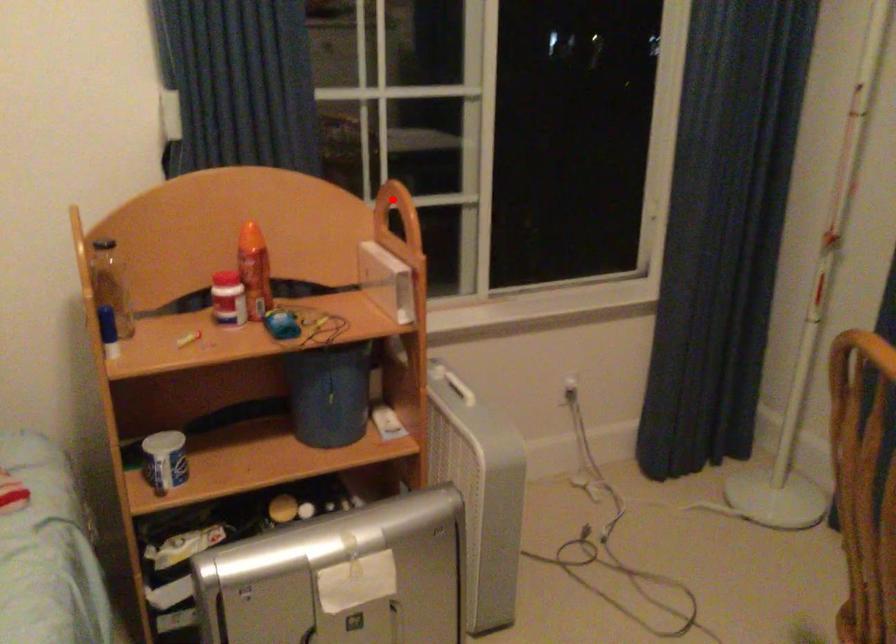
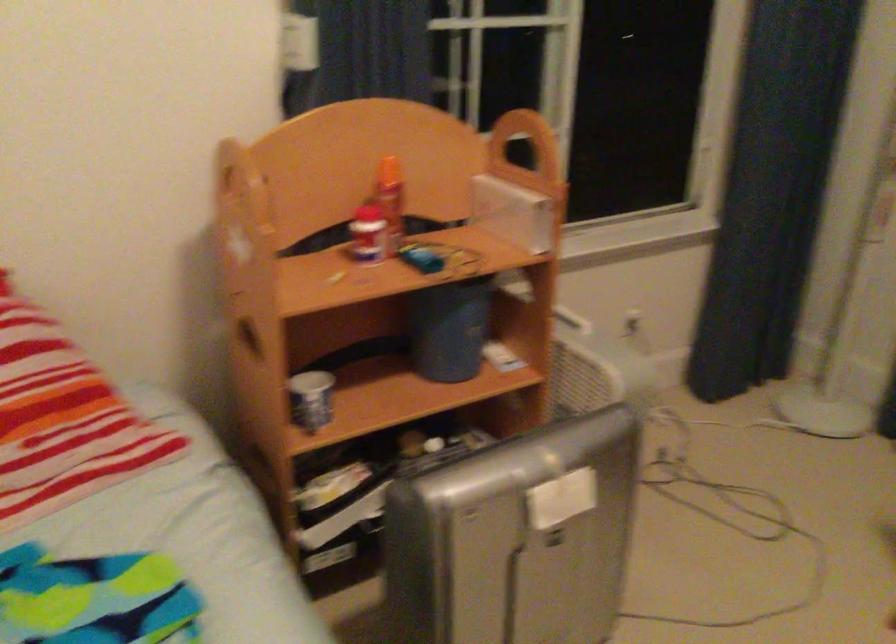
Where in the second image is the point corresponding to the highlighted location from the first image?

(512, 128)